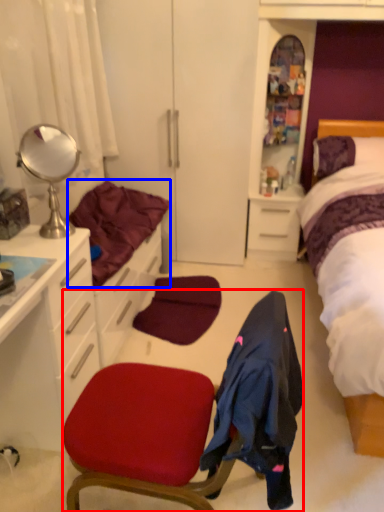
Question: Which object appears farthest to the camera in this image, chair (highlighted by a red box) or bedding (highlighted by a blue box)?

Choices:
 (A) chair
 (B) bedding

Answer: (B)